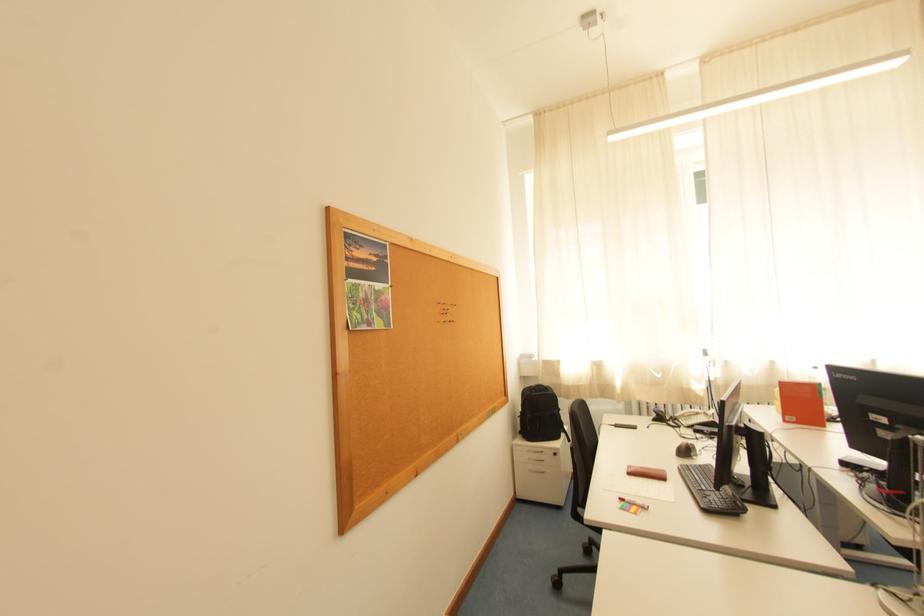
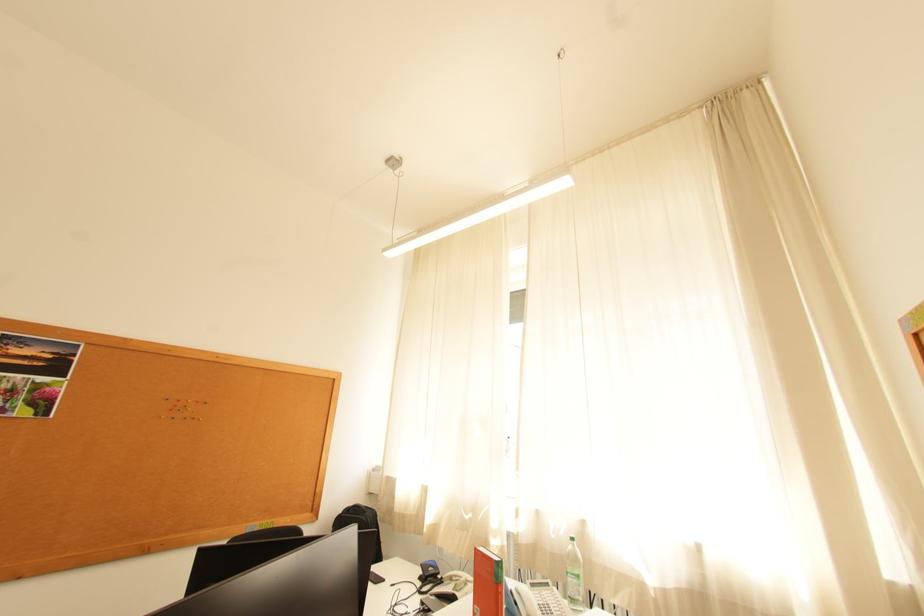
Question: What movement of the cameraman would produce the second image?

Choices:
 (A) Left
 (B) Right
 (C) Forward
 (D) Backward

Answer: (B)